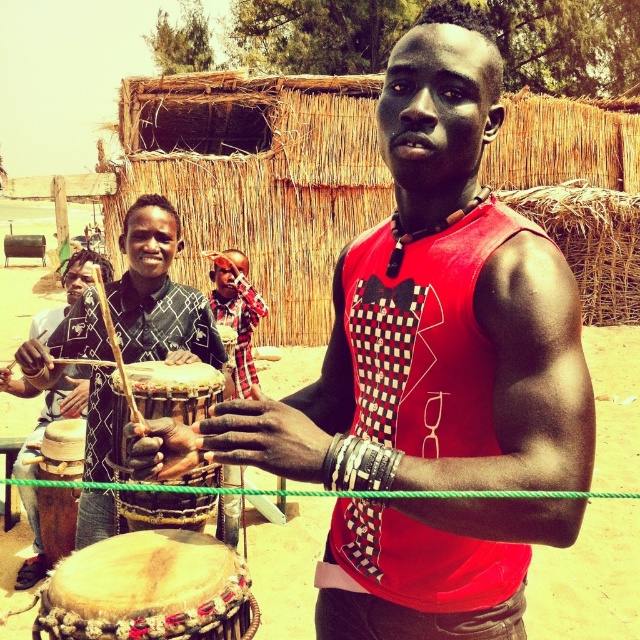
You are standing at point (202, 557) and want to walk to the thatched roof structure in the background. Is the point (301, 376) in your path?

Yes, point (301, 376) is behind point (202, 557), so it is in your path towards the thatched roof structure.